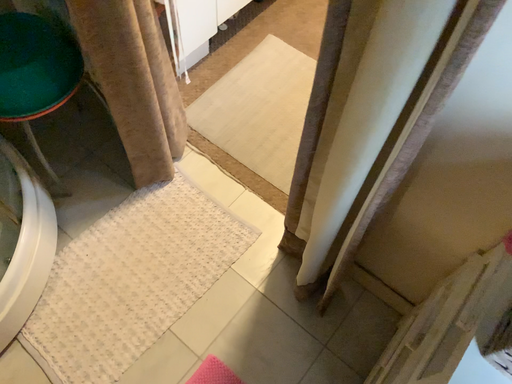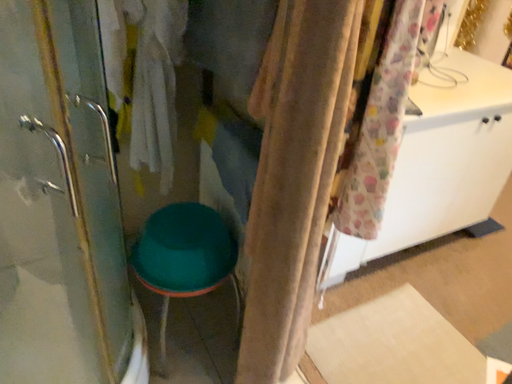
Question: How did the camera likely rotate when shooting the video?

Choices:
 (A) rotated right
 (B) rotated left

Answer: (B)